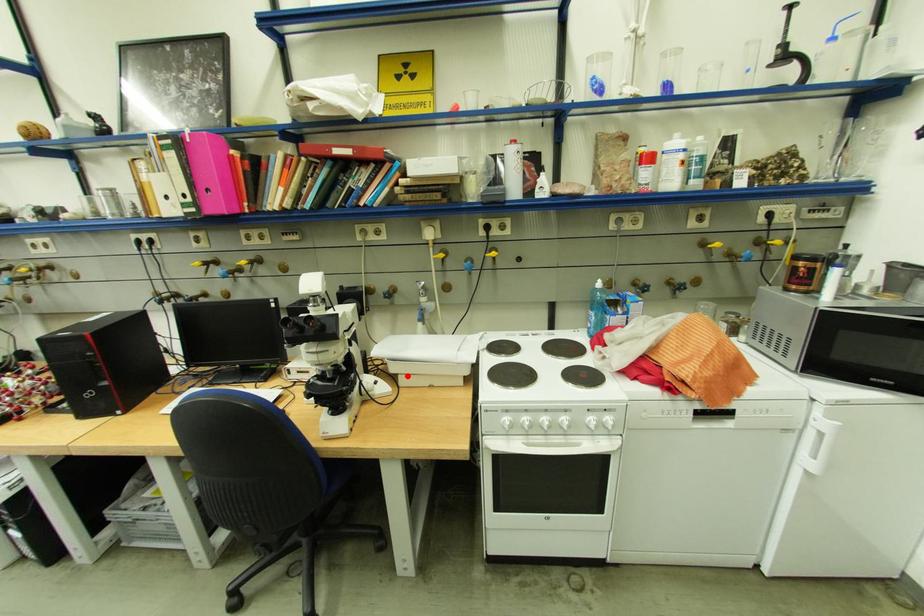
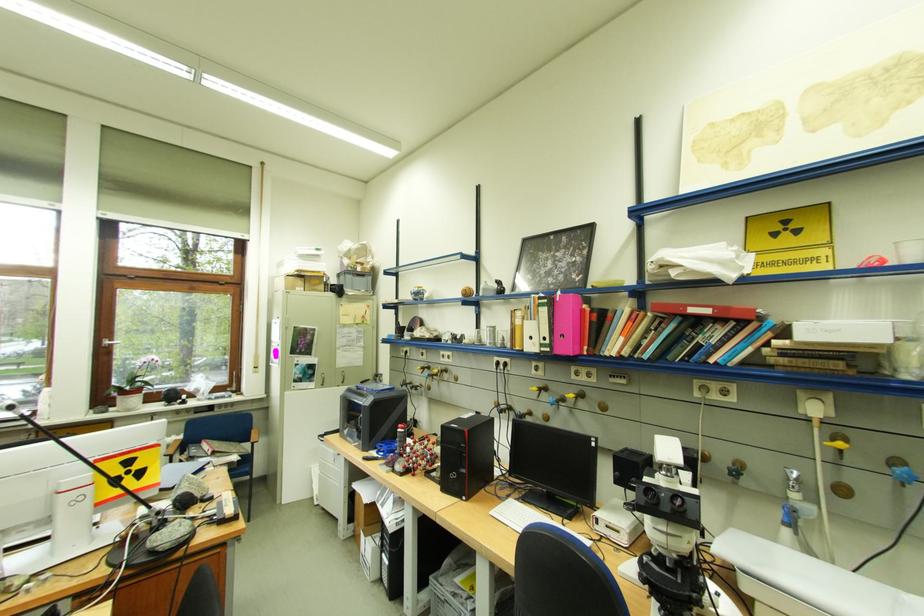
Where in the second image is the point corresponding to the highlighted location from the first image?

(763, 601)